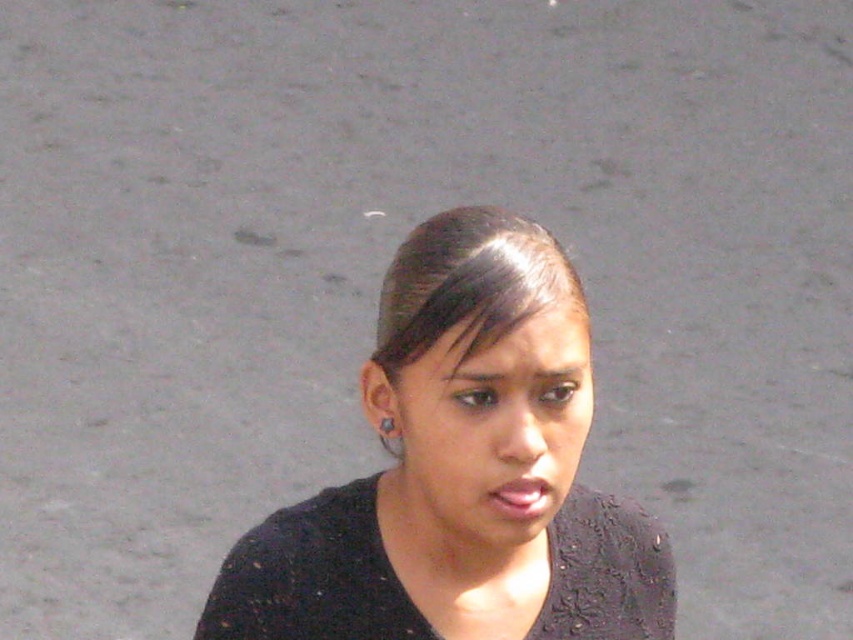
Is black matte shirt at center to the left of silver metallic earring at upper left from the viewer's perspective?

Incorrect, black matte shirt at center is not on the left side of silver metallic earring at upper left.

Is point (488, 384) in front of point (390, 429)?

Yes, point (488, 384) is in front of point (390, 429).

Image resolution: width=853 pixels, height=640 pixels. I want to click on black matte shirt at center, so click(462, 472).

Does smooth skin face at center have a lesser width compared to silver metallic earring at upper left?

No, smooth skin face at center is not thinner than silver metallic earring at upper left.

Is point (488, 467) in front of point (389, 419)?

Yes, it is in front of point (389, 419).

The image size is (853, 640). In order to click on smooth skin face at center in this screenshot , I will do `click(489, 433)`.

Is black matte shirt at center taller than smooth skin face at center?

Correct, black matte shirt at center is much taller as smooth skin face at center.

Between black matte shirt at center and smooth skin face at center, which one has less height?

With less height is smooth skin face at center.

Is point (555, 621) closer to viewer compared to point (505, 433)?

No, it is not.

Where is `black matte shirt at center`? The width and height of the screenshot is (853, 640). black matte shirt at center is located at coordinates (462, 472).